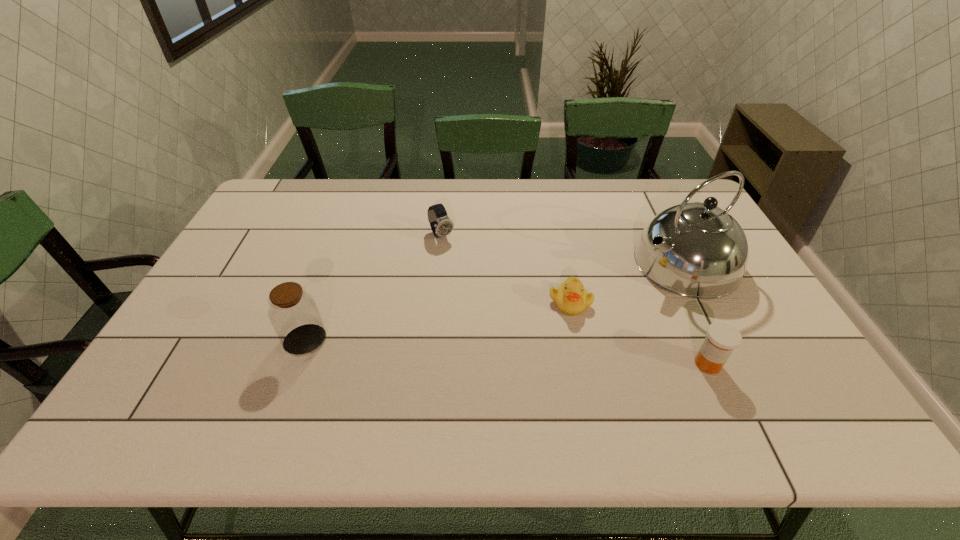
Identify the location of object present at the near edge. (722, 338).

This screenshot has height=540, width=960. What are the coordinates of `object that is at the right edge` in the screenshot? It's located at (697, 250).

I want to click on vacant space at the far edge of the desktop, so click(657, 214).

In the image, there is a desktop. In order to click on vacant space at the left edge in this screenshot , I will do `click(243, 232)`.

The width and height of the screenshot is (960, 540). What are the coordinates of `free space at the right edge of the desktop` in the screenshot? It's located at (751, 336).

At what (x,y) coordinates should I click in order to perform the action: click on vacant space at the near right corner of the desktop. Please return your answer as a coordinate pair (x, y). Looking at the image, I should click on 740,364.

Locate an element on the screen. vacant space that's between the watch and the fourth shortest object is located at coordinates (373, 288).

At what (x,y) coordinates should I click in order to perform the action: click on unoccupied position between the medicine and the tallest object. Please return your answer as a coordinate pair (x, y). Looking at the image, I should click on (696, 314).

At what (x,y) coordinates should I click in order to perform the action: click on vacant space in between the kettle and the leftmost object. Please return your answer as a coordinate pair (x, y). Looking at the image, I should click on (494, 301).

The image size is (960, 540). Identify the location of free space that is in between the leftmost object and the duckling. (438, 321).